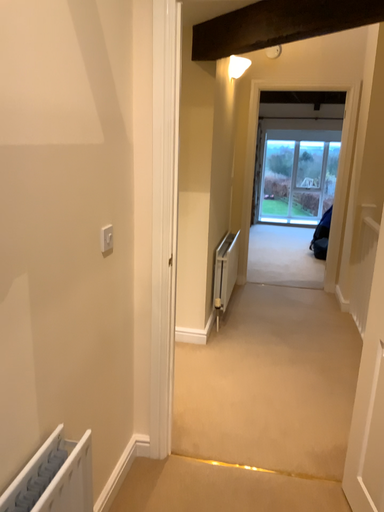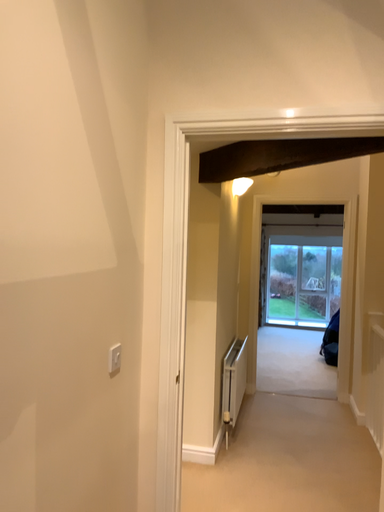
Question: Which way did the camera rotate in the video?

Choices:
 (A) rotated upward
 (B) rotated downward

Answer: (A)